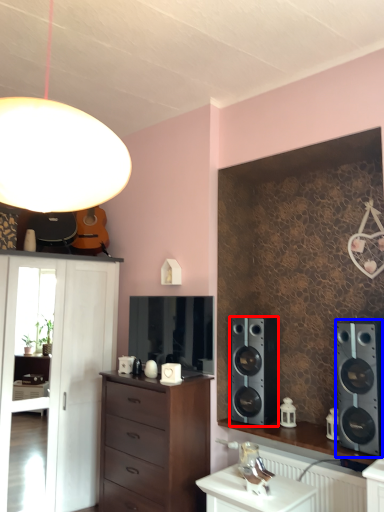
Question: Which of the following is the farthest to the observer, speaker (highlighted by a red box) or speaker (highlighted by a blue box)?

Choices:
 (A) speaker
 (B) speaker

Answer: (A)